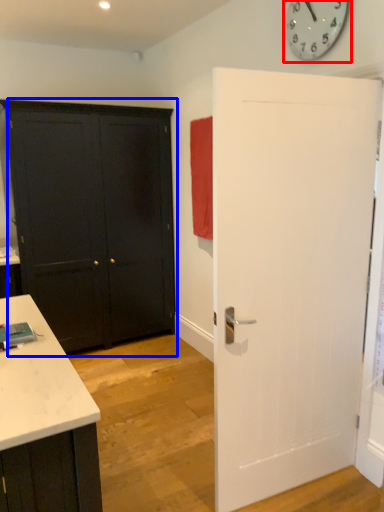
Question: Among these objects, which one is nearest to the camera, clock (highlighted by a red box) or door (highlighted by a blue box)?

Choices:
 (A) clock
 (B) door

Answer: (A)